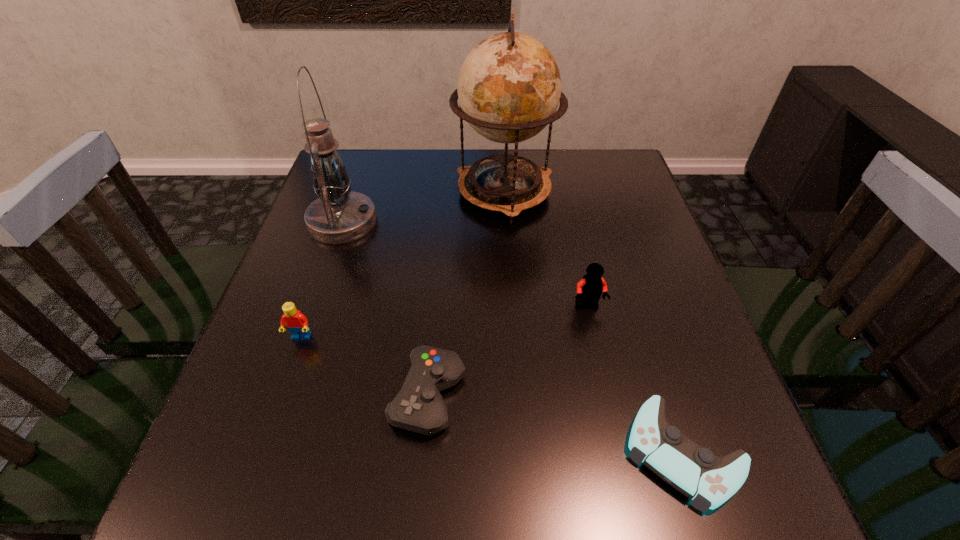
This screenshot has width=960, height=540. In order to click on empty location between the left control and the shorter control in this screenshot , I will do `click(556, 424)`.

Find the location of a particular element. Image resolution: width=960 pixels, height=540 pixels. vacant area that lies between the right Lego and the globe is located at coordinates (546, 249).

Find the location of a particular element. unoccupied area between the farther Lego and the left control is located at coordinates (509, 352).

I want to click on free point between the second tallest object and the third shortest object, so click(322, 279).

Locate an element on the screen. The height and width of the screenshot is (540, 960). free space between the right control and the third nearest object is located at coordinates (492, 395).

This screenshot has width=960, height=540. Identify the location of free spot between the oil lamp and the right Lego. (466, 264).

Where is `empty space between the fourth tallest object and the globe`? Image resolution: width=960 pixels, height=540 pixels. empty space between the fourth tallest object and the globe is located at coordinates (402, 265).

Locate an element on the screen. Image resolution: width=960 pixels, height=540 pixels. the fourth closest object to the oil lamp is located at coordinates (590, 287).

Identify the location of the closest object to the shorter control. The image size is (960, 540). (590, 287).

I want to click on vacant space that satisfies the following two spatial constraints: 1. on the front side of the fifth shortest object; 2. on the left side of the taller control, so click(282, 396).